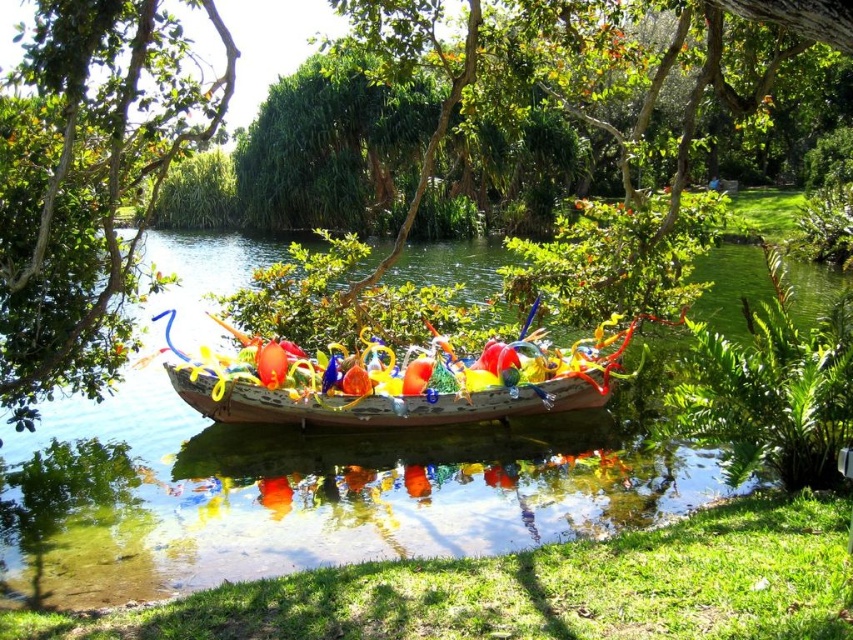
Can you confirm if green leafy tree at left is bigger than translucent glass boat at center?

Indeed, green leafy tree at left has a larger size compared to translucent glass boat at center.

Who is positioned more to the left, green leafy tree at left or translucent glass boat at center?

Positioned to the left is green leafy tree at left.

Between point (90, 280) and point (386, 355), which one is positioned in front?

Point (90, 280) is in front.

I want to click on green leafy tree at left, so click(x=88, y=186).

Does point (39, 67) lie behind point (178, 147)?

That is False.

Does green leafy tree at left appear on the right side of green leafy tree at center?

Incorrect, green leafy tree at left is not on the right side of green leafy tree at center.

At what (x,y) coordinates should I click in order to perform the action: click on green leafy tree at left. Please return your answer as a coordinate pair (x, y). This screenshot has height=640, width=853. Looking at the image, I should click on (88, 186).

Is green leafy tree at center wider than translucent glass boat at center?

Yes, green leafy tree at center is wider than translucent glass boat at center.

Is green leafy tree at center positioned at the back of translucent glass boat at center?

No, green leafy tree at center is closer to the viewer.

In order to click on green leafy tree at center in this screenshot , I will do click(x=90, y=186).

At what (x,y) coordinates should I click in order to perform the action: click on green leafy tree at center. Please return your answer as a coordinate pair (x, y). The height and width of the screenshot is (640, 853). Looking at the image, I should click on (90, 186).